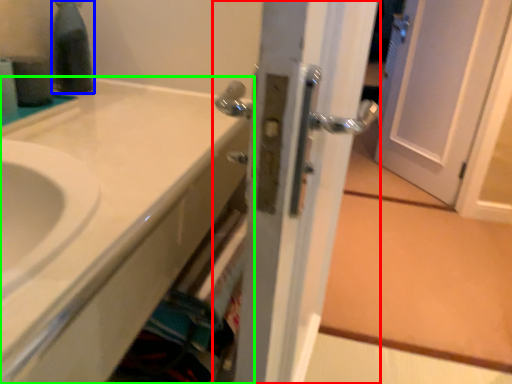
Question: Which object is positioned closest to door (highlighted by a red box)? Select from bottle (highlighted by a blue box) and bathroom cabinet (highlighted by a green box).

Choices:
 (A) bottle
 (B) bathroom cabinet

Answer: (B)